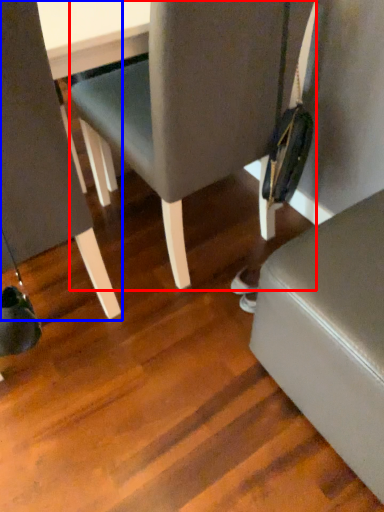
Question: Which point is closer to the camera, chair (highlighted by a red box) or chair (highlighted by a blue box)?

Choices:
 (A) chair
 (B) chair

Answer: (B)